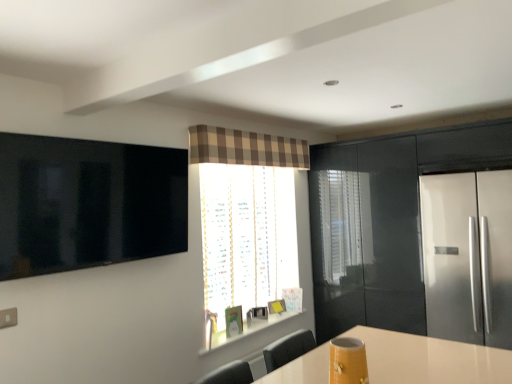
Question: Is matte yellow vase at lower center in front of or behind glossy black cabinet at right in the image?

Choices:
 (A) front
 (B) behind

Answer: (A)

Question: Based on their sizes in the image, would you say matte yellow vase at lower center is bigger or smaller than glossy black cabinet at right?

Choices:
 (A) big
 (B) small

Answer: (B)

Question: Based on their relative distances, which object is farther from the satin silver fridge at right?

Choices:
 (A) matte yellow vase at lower center
 (B) glossy black cabinet at right
 (C) translucent fabric window at center
 (D) brown plaid curtain at upper center

Answer: (A)

Question: Which is nearer to the translucent fabric window at center?

Choices:
 (A) brown plaid curtain at upper center
 (B) matte yellow vase at lower center
 (C) glossy black cabinet at right
 (D) satin silver fridge at right

Answer: (A)